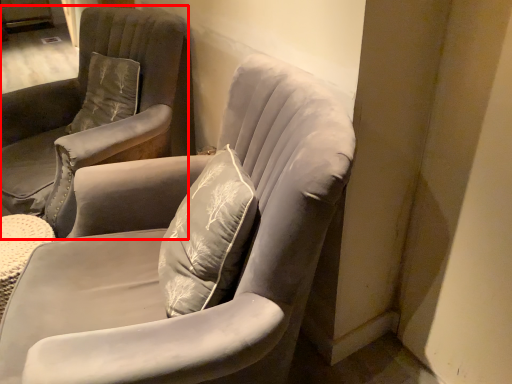
Question: From the image, what is the correct spatial relationship of chair (annotated by the red box) in relation to chair?

Choices:
 (A) right
 (B) left

Answer: (B)